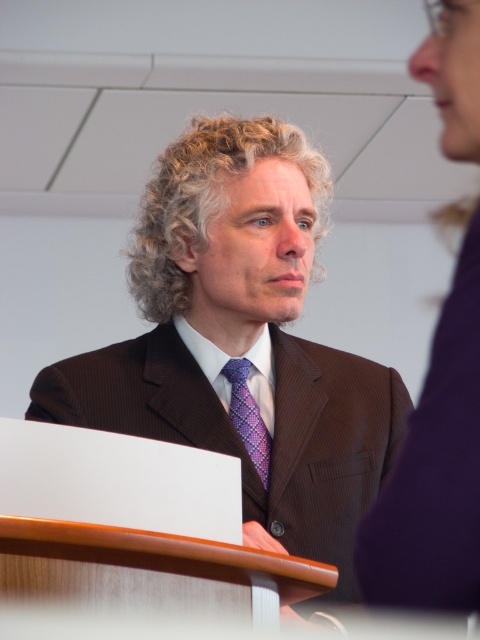
Who is more distant from viewer, [140,417] or [276,320]?

Positioned behind is point [276,320].

Does point (163, 192) lie in front of point (317, 186)?

Yes, point (163, 192) is closer to viewer.

Who is more distant from viewer, (314,516) or (220,150)?

The point (220,150) is behind.

At what (x,y) coordinates should I click in order to perform the action: click on brown textured suit at center. Please return your answer as a coordinate pair (x, y). This screenshot has width=480, height=640. Looking at the image, I should click on (241, 339).

Can you confirm if curly blonde hair at center is positioned above purple woven tie at center?

Correct, curly blonde hair at center is located above purple woven tie at center.

I want to click on curly blonde hair at center, so click(x=206, y=200).

This screenshot has height=640, width=480. What are the coordinates of `curly blonde hair at center` in the screenshot? It's located at (206, 200).

Does brown textured suit at center have a lesser width compared to purple woven tie at center?

No, brown textured suit at center is not thinner than purple woven tie at center.

Identify the location of brown textured suit at center. (241, 339).